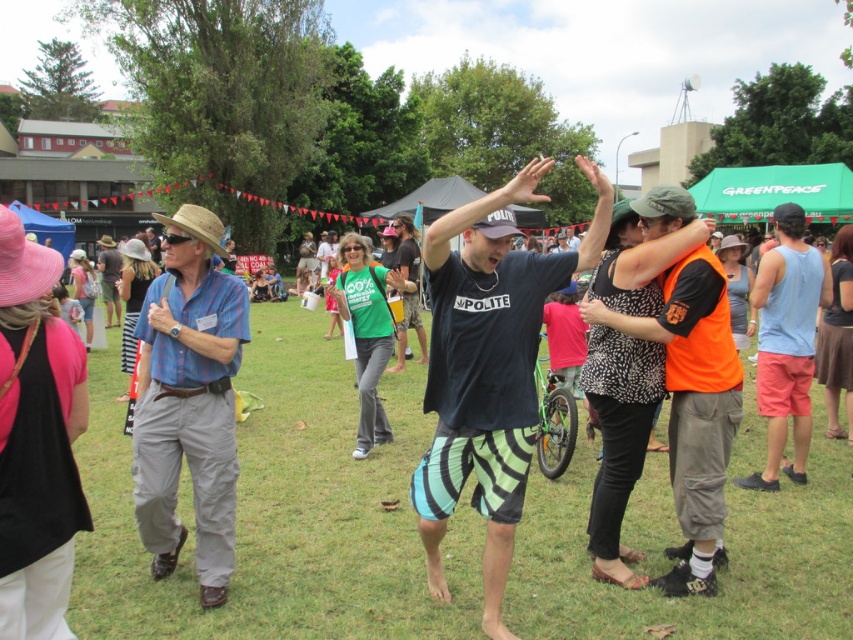
Looking at this image, which is below, green grass at center or light blue tank top at right?

green grass at center is below.

Image resolution: width=853 pixels, height=640 pixels. I want to click on green grass at center, so click(281, 509).

Where is `blue plaid shirt at left`? blue plaid shirt at left is located at coordinates (189, 401).

Can you confirm if blue plaid shirt at left is positioned above light blue tank top at right?

No.

Which is behind, point (161, 280) or point (786, 275)?

The point (786, 275) is behind.

The width and height of the screenshot is (853, 640). I want to click on blue plaid shirt at left, so click(x=189, y=401).

Is green grass at center to the left of black cotton t-shirt at center from the viewer's perspective?

Correct, you'll find green grass at center to the left of black cotton t-shirt at center.

Where is `green grass at center`? This screenshot has width=853, height=640. green grass at center is located at coordinates (281, 509).

What do you see at coordinates (281, 509) in the screenshot? The image size is (853, 640). I see `green grass at center` at bounding box center [281, 509].

Locate an element on the screen. green grass at center is located at coordinates (281, 509).